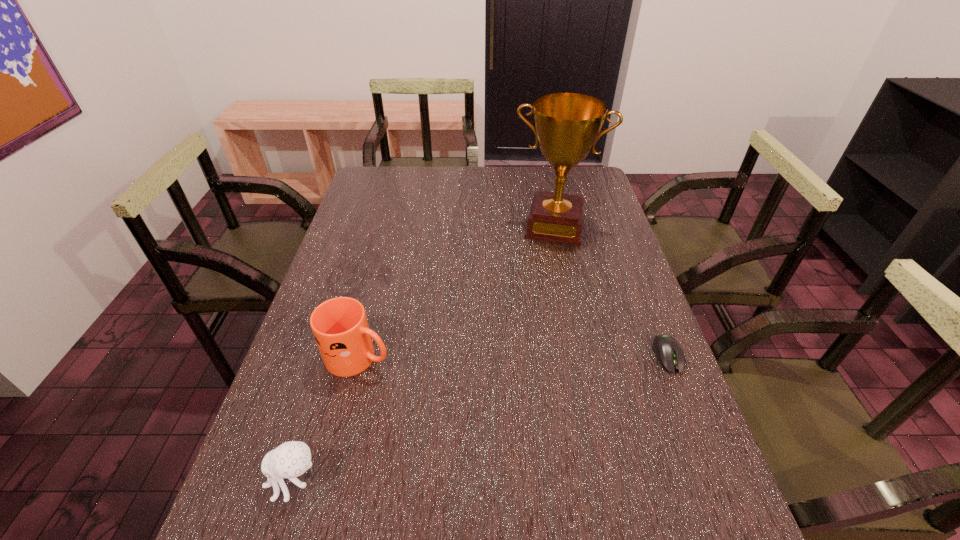
Locate an element on the screen. The height and width of the screenshot is (540, 960). vacant space on the desktop that is between the second shortest object and the shortest object and is positioned on the handle side of the third shortest object is located at coordinates (516, 406).

Find the location of `vacant space on the desktop that is between the octopus and the shortest object and is positioned on the plaque of the tallest object`. vacant space on the desktop that is between the octopus and the shortest object and is positioned on the plaque of the tallest object is located at coordinates (524, 403).